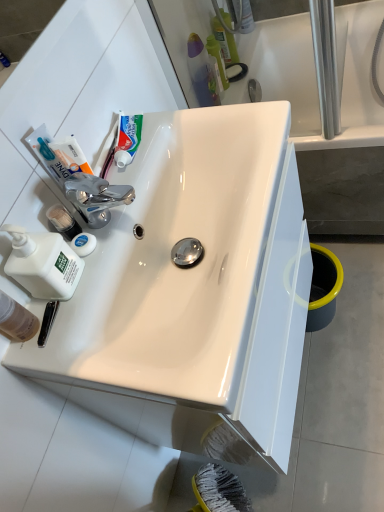
Find the location of a particular element. This screenshot has width=384, height=512. vacant space to the right of green matte toothpaste at upper center is located at coordinates (191, 122).